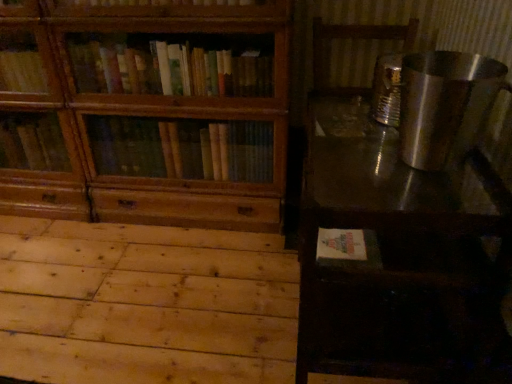
I want to click on wooden bookcase at left, so click(x=145, y=111).

Is wooden bookcase at left facing towards natural wood plywood at lower left?

Yes, wooden bookcase at left is oriented towards natural wood plywood at lower left.

Which is in front, point (4, 106) or point (4, 296)?

The point (4, 296) is closer to the camera.

Is wooden bookcase at left at the left side of natural wood plywood at lower left?

Indeed, wooden bookcase at left is positioned on the left side of natural wood plywood at lower left.

From a real-world perspective, who is located lower, metallic reflective table at right or natural wood plywood at lower left?

natural wood plywood at lower left is physically lower.

Is metallic reflective table at right next to natural wood plywood at lower left and touching it?

metallic reflective table at right is not next to natural wood plywood at lower left, and they're not touching.

Is metallic reflective table at right bigger than natural wood plywood at lower left?

Indeed, metallic reflective table at right has a larger size compared to natural wood plywood at lower left.

From the image's perspective, which one is positioned lower, metallic reflective table at right or natural wood plywood at lower left?

natural wood plywood at lower left is shown below in the image.

Would you say natural wood plywood at lower left is to the left or to the right of metallic reflective table at right in the picture?

In the image, natural wood plywood at lower left appears on the left side of metallic reflective table at right.

Which object is wider, natural wood plywood at lower left or metallic reflective table at right?

With larger width is natural wood plywood at lower left.

In the image, is natural wood plywood at lower left positioned in front of or behind metallic reflective table at right?

natural wood plywood at lower left is behind metallic reflective table at right.

Is natural wood plywood at lower left aimed at metallic reflective table at right?

No.

Based on their sizes in the image, would you say wooden bookcase at left is bigger or smaller than metallic reflective table at right?

wooden bookcase at left is bigger than metallic reflective table at right.

Who is more distant, wooden bookcase at left or metallic reflective table at right?

wooden bookcase at left is more distant.

Is wooden bookcase at left positioned with its back to metallic reflective table at right?

No, wooden bookcase at left's orientation is not away from metallic reflective table at right.

Consider the image. In the image, is wooden bookcase at left on the left side or the right side of metallic reflective table at right?

Clearly, wooden bookcase at left is on the left of metallic reflective table at right in the image.

I want to click on bookcase that appears on the left of natural wood plywood at lower left, so click(x=145, y=111).

Which is in front, natural wood plywood at lower left or wooden bookcase at left?

natural wood plywood at lower left is in front.

Which object is thinner, natural wood plywood at lower left or wooden bookcase at left?

wooden bookcase at left.

Considering the sizes of objects metallic reflective table at right and wooden bookcase at left in the image provided, who is smaller, metallic reflective table at right or wooden bookcase at left?

Smaller between the two is metallic reflective table at right.

Which object is wider, metallic reflective table at right or wooden bookcase at left?

With larger width is metallic reflective table at right.

Does metallic reflective table at right have a lesser height compared to wooden bookcase at left?

Yes, metallic reflective table at right is shorter than wooden bookcase at left.

What's the angular difference between metallic reflective table at right and wooden bookcase at left's facing directions?

The angle between the facing direction of metallic reflective table at right and the facing direction of wooden bookcase at left is 91.3 degrees.

Image resolution: width=512 pixels, height=384 pixels. I want to click on plywood that appears below the wooden bookcase at left (from the image's perspective), so click(x=148, y=301).

At what (x,y) coordinates should I click in order to perform the action: click on table located above the natural wood plywood at lower left (from a real-world perspective). Please return your answer as a coordinate pair (x, y). Looking at the image, I should click on (394, 262).

When comparing their distances from natural wood plywood at lower left, does wooden bookcase at left or metallic reflective table at right seem closer?

wooden bookcase at left is closer to natural wood plywood at lower left.

Which object lies further to the anchor point metallic reflective table at right, natural wood plywood at lower left or wooden bookcase at left?

Among the two, wooden bookcase at left is located further to metallic reflective table at right.

Considering their positions, is natural wood plywood at lower left positioned closer to wooden bookcase at left than metallic reflective table at right?

natural wood plywood at lower left is positioned closer to the anchor wooden bookcase at left.

Estimate the real-world distances between objects in this image. Which object is closer to metallic reflective table at right, wooden bookcase at left or natural wood plywood at lower left?

natural wood plywood at lower left.

In the scene shown: Considering their positions, is metallic reflective table at right positioned closer to natural wood plywood at lower left than wooden bookcase at left?

wooden bookcase at left is closer to natural wood plywood at lower left.

Based on their spatial positions, is metallic reflective table at right or natural wood plywood at lower left closer to wooden bookcase at left?

The object closer to wooden bookcase at left is natural wood plywood at lower left.

Locate an element on the screen. The image size is (512, 384). plywood between wooden bookcase at left and metallic reflective table at right is located at coordinates (148, 301).